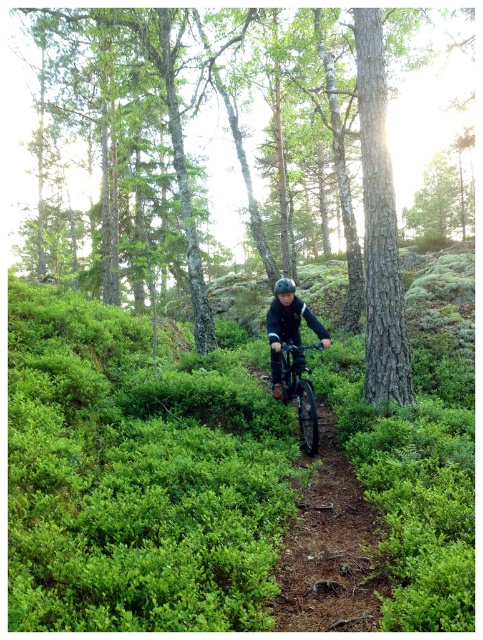
Question: Can you confirm if metallic matte bicycle at center is bigger than black matte helmet at center?

Choices:
 (A) no
 (B) yes

Answer: (A)

Question: Among these points, which one is farthest from the camera?

Choices:
 (A) (286, 8)
 (B) (300, 380)
 (C) (280, 285)
 (D) (269, 342)

Answer: (A)

Question: Which point is closer to the camera?

Choices:
 (A) matte black helmet at center
 (B) metallic matte bicycle at center
 (C) black matte helmet at center
 (D) rough bark tree at center

Answer: (B)

Question: Which object appears closest to the camera in this image?

Choices:
 (A) matte black helmet at center
 (B) black matte helmet at center

Answer: (A)

Question: Can you confirm if rough bark tree at center is positioned below black matte helmet at center?

Choices:
 (A) yes
 (B) no

Answer: (B)

Question: Is rough bark tree at center below matte black helmet at center?

Choices:
 (A) yes
 (B) no

Answer: (B)